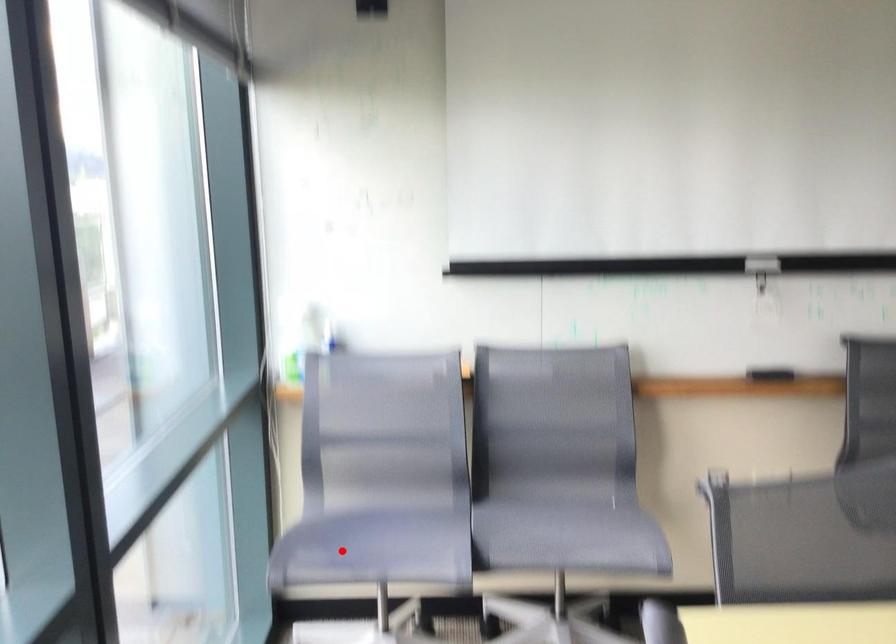
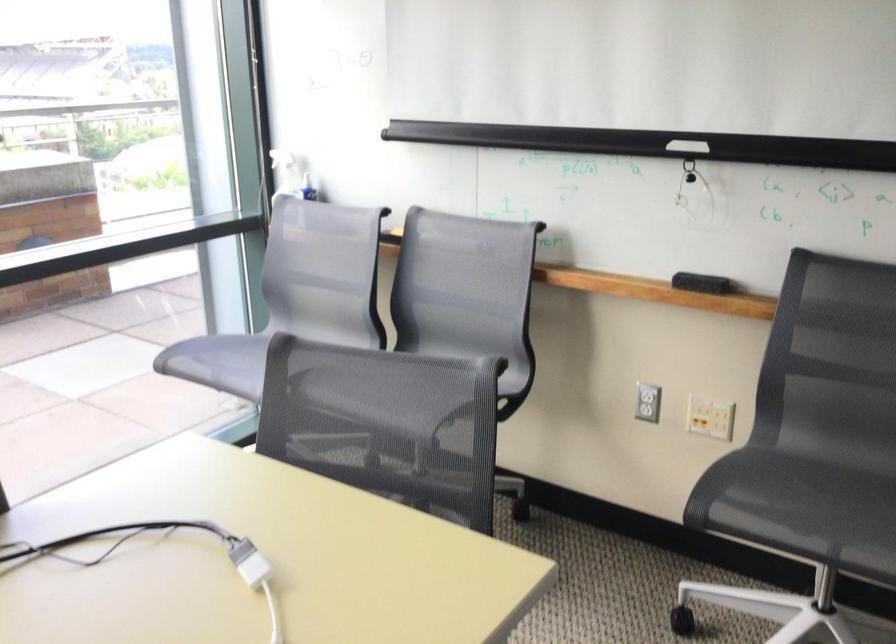
Question: I am providing you with two images of the same scene from different viewpoints. In image1, a red point is highlighted. Considering the same 3D point in image2, which of the following is correct?

Choices:
 (A) It is closer
 (B) It is farther

Answer: (B)